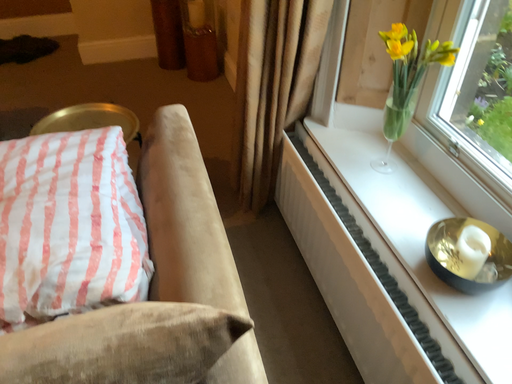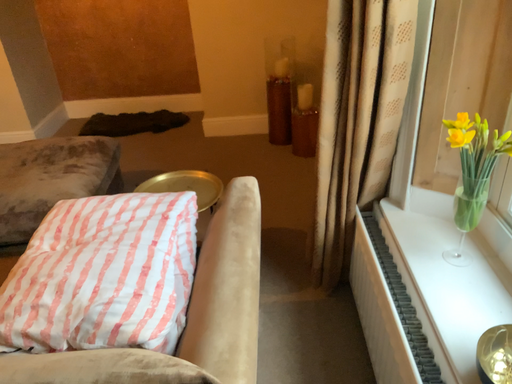
Question: Which way did the camera rotate in the video?

Choices:
 (A) rotated upward
 (B) rotated downward

Answer: (A)